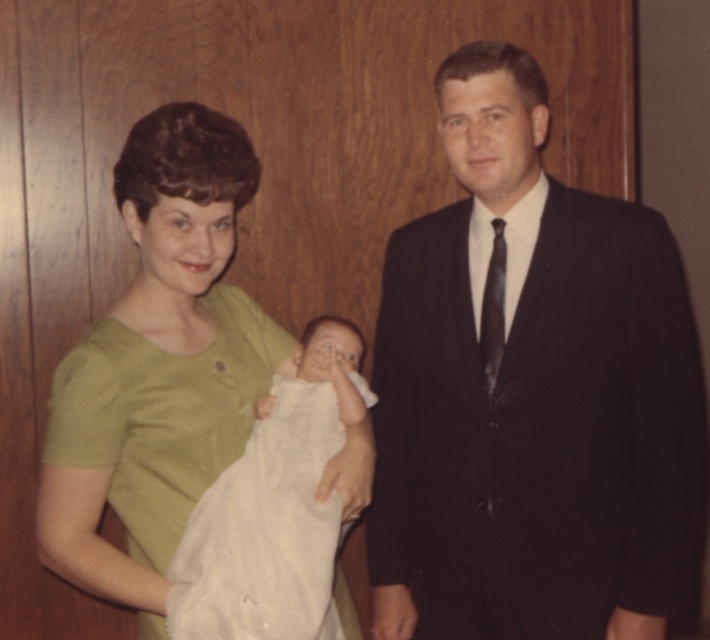
Is point (525, 628) positioned behind point (160, 243)?

Yes, point (525, 628) is behind point (160, 243).

Between dark suit at center and green matte dress at center, which one appears on the right side from the viewer's perspective?

dark suit at center

The height and width of the screenshot is (640, 710). Describe the element at coordinates (530, 394) in the screenshot. I see `dark suit at center` at that location.

I want to click on dark suit at center, so click(530, 394).

This screenshot has width=710, height=640. What are the coordinates of `green matte dress at center` in the screenshot? It's located at (158, 365).

Which is behind, point (185, 328) or point (246, 612)?

Positioned behind is point (185, 328).

Does point (65, 356) lie behind point (310, 609)?

Yes, it is.

The height and width of the screenshot is (640, 710). In order to click on green matte dress at center in this screenshot , I will do `click(158, 365)`.

Does dark suit at center appear on the left side of white soft cloth at center?

No, dark suit at center is not to the left of white soft cloth at center.

Is point (435, 372) farther from camera compared to point (300, 396)?

Yes, point (435, 372) is behind point (300, 396).

The width and height of the screenshot is (710, 640). Identify the location of dark suit at center. (530, 394).